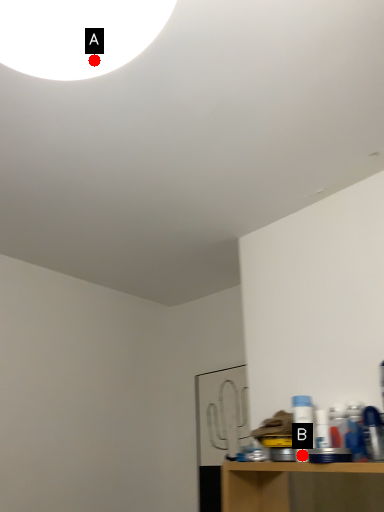
Question: Two points are circled on the image, labeled by A and B beside each circle. Which point appears farthest from the camera in this image?

Choices:
 (A) A is further
 (B) B is further

Answer: (B)